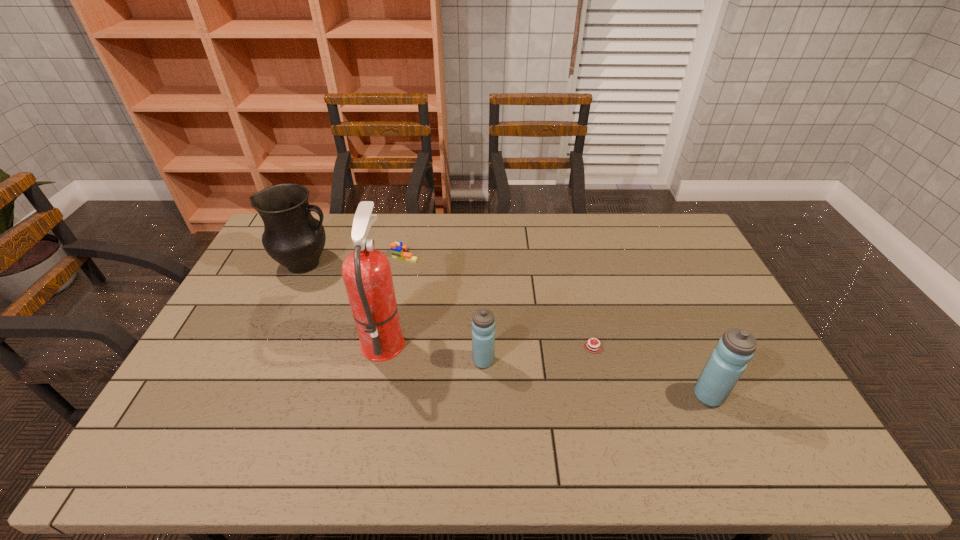
Find the location of a particular element. The image size is (960, 540). the left water bottle is located at coordinates (483, 324).

You are a GUI agent. You are given a task and a screenshot of the screen. Output one action in this format:
    pyautogui.click(x=<x>, y=<y>)
    Task: Click on the third shortest object
    This screenshot has width=960, height=540.
    Given the screenshot: What is the action you would take?
    pyautogui.click(x=483, y=324)

Locate an element on the screen. This screenshot has height=540, width=960. the rightmost object is located at coordinates (728, 361).

I want to click on the nearest object, so click(x=728, y=361).

Locate an element on the screen. The image size is (960, 540). Lego is located at coordinates (398, 250).

In order to click on pitcher in this screenshot , I will do `click(292, 236)`.

I want to click on the fifth object from left to right, so click(591, 346).

At what (x,y) coordinates should I click in order to perform the action: click on chocolate cake. Please return your answer as a coordinate pair (x, y). The image size is (960, 540). Looking at the image, I should click on (591, 346).

At what (x,y) coordinates should I click in order to perform the action: click on the tallest object. Please return your answer as a coordinate pair (x, y). The height and width of the screenshot is (540, 960). Looking at the image, I should click on (366, 272).

This screenshot has height=540, width=960. Identify the location of vacant space positioned 0.170m on the right of the third shortest object. (555, 361).